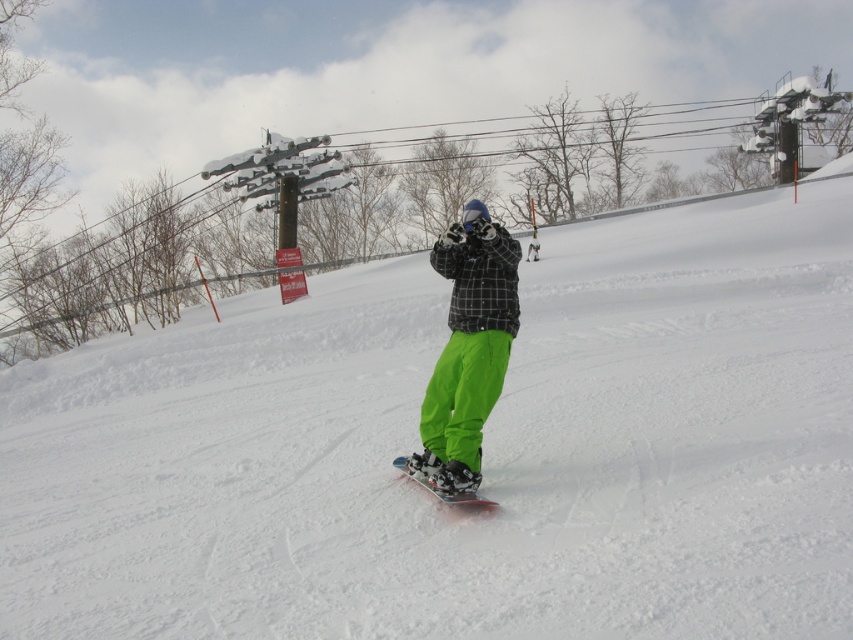
You are a photographer trying to capture the snowboarder. You notice the neon green pants at center and the black matte snowboard at center. Which object should you focus on first if you want to photograph the one closer to the right side of the frame?

The neon green pants at center is to the right of black matte snowboard at center, so you should focus on the neon green pants at center first as it is closer to the right side of the frame.

You are a photographer trying to capture the snowboarder in motion. You notice the neon green pants at center and the black matte snowboard at center. Which object is positioned higher in the image?

The neon green pants at center is above the black matte snowboard at center, so it is positioned higher in the image.

You are a photographer trying to capture the snowboarder in the scene. Since the neon green pants at center and the black matte snowboard at center are both at the center, which one appears narrower in the photo?

The neon green pants at center appears narrower because it is thinner than the black matte snowboard at center.